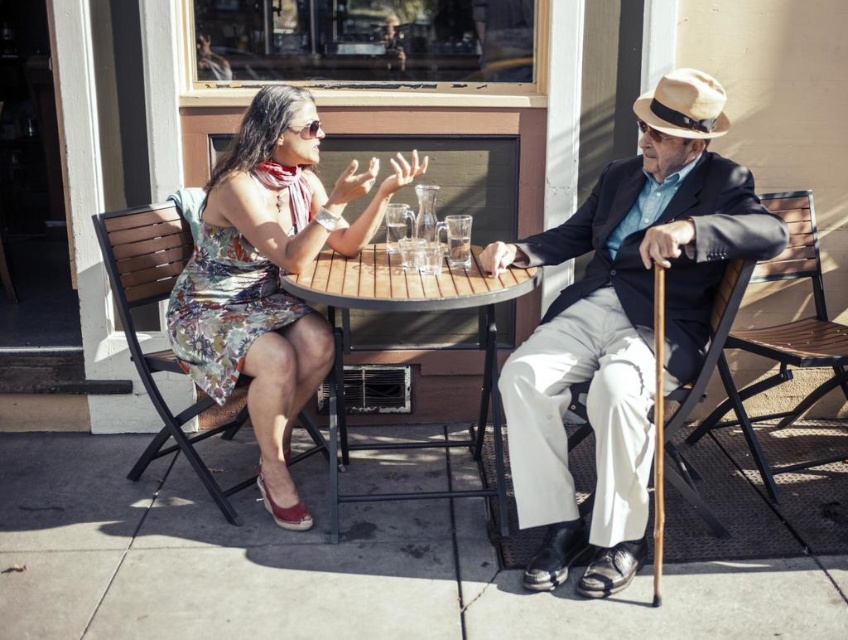
Question: Can you confirm if floral dress at left is positioned below light brown leather suit at right?

Choices:
 (A) no
 (B) yes

Answer: (A)

Question: Is floral dress at left positioned in front of floral dress at center?

Choices:
 (A) yes
 (B) no

Answer: (A)

Question: Which object is closer to the camera taking this photo?

Choices:
 (A) light brown leather suit at right
 (B) clear glass mug at center
 (C) wooden table at center

Answer: (C)

Question: Which of the following is the farthest from the observer?

Choices:
 (A) (576, 252)
 (B) (322, 188)
 (C) (473, 280)

Answer: (B)

Question: Considering the real-world distances, which object is farthest from the floral dress at center?

Choices:
 (A) clear glass mug at center
 (B) floral dress at left
 (C) wooden table at center

Answer: (B)

Question: Is wooden table at center wider than clear glass mug at center?

Choices:
 (A) yes
 (B) no

Answer: (A)